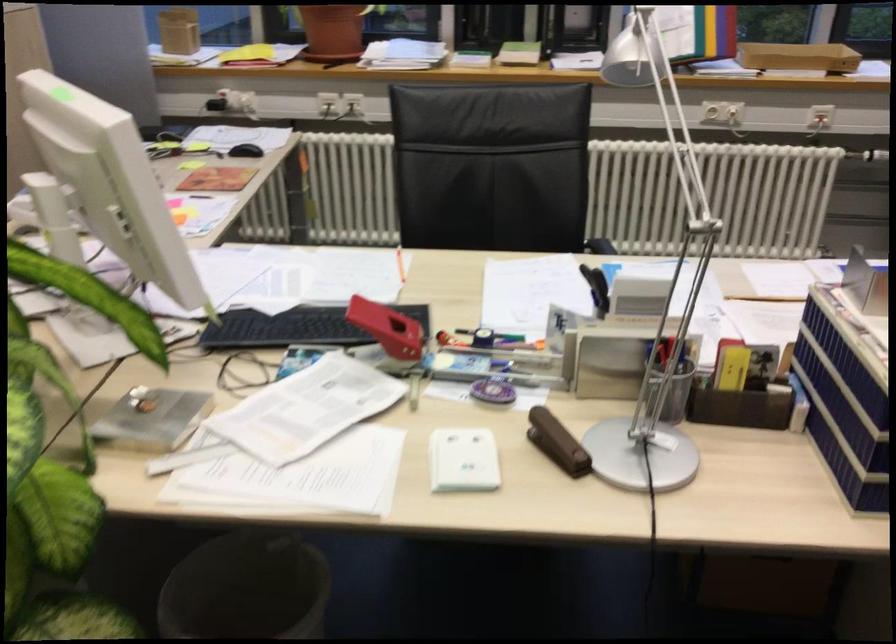
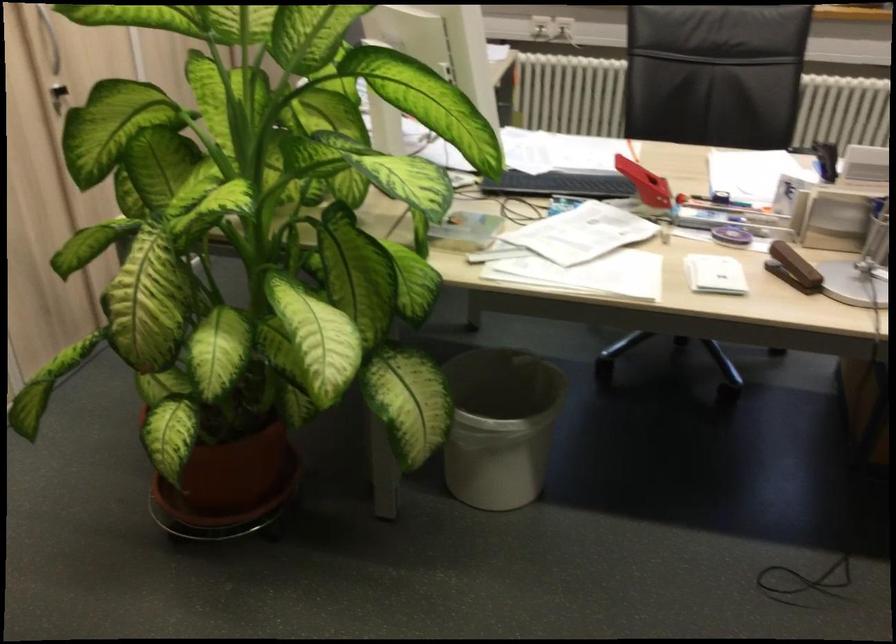
Locate, in the second image, the point that corresponds to the point at 392,330 in the first image.

(644, 183)